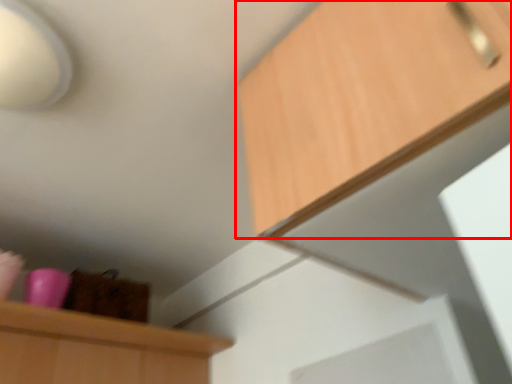
Question: From the image's perspective, what is the correct spatial positioning of cabinetry (annotated by the red box) in reference to lamp?

Choices:
 (A) below
 (B) above

Answer: (A)